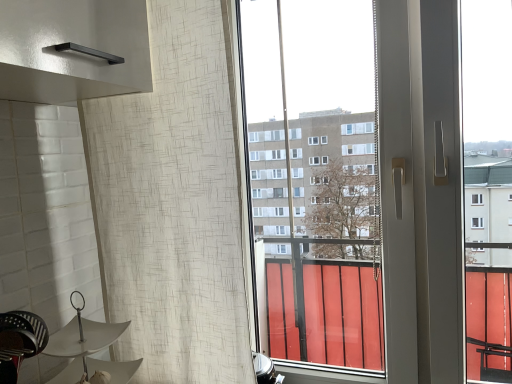
Where is `white textured curtain at left`? This screenshot has height=384, width=512. white textured curtain at left is located at coordinates (174, 203).

The width and height of the screenshot is (512, 384). Find the location of `white matte umbrella at lower left`. white matte umbrella at lower left is located at coordinates (88, 349).

What's the angular difference between white textured curtain at left and metallic black swivel chair at lower left's facing directions?

They differ by 85 degrees in their facing directions.

Is white textured curtain at left not close to metallic black swivel chair at lower left?

Actually, white textured curtain at left and metallic black swivel chair at lower left are a little close together.

Can you confirm if white textured curtain at left is positioned to the right of metallic black swivel chair at lower left?

Indeed, white textured curtain at left is positioned on the right side of metallic black swivel chair at lower left.

Considering the positions of objects white textured curtain at left and metallic black swivel chair at lower left in the image provided, who is behind, white textured curtain at left or metallic black swivel chair at lower left?

white textured curtain at left is further away from the camera.

Considering the points (84, 304) and (219, 237), which point is behind, point (84, 304) or point (219, 237)?

Point (84, 304)

Is white matte umbrella at lower left not close to white textured curtain at left?

They are positioned close to each other.

Can you confirm if white matte umbrella at lower left is shorter than white textured curtain at left?

Correct, white matte umbrella at lower left is not as tall as white textured curtain at left.

Is white matte umbrella at lower left positioned with its back to white textured curtain at left?

No, white matte umbrella at lower left's orientation is not away from white textured curtain at left.

Is point (16, 312) positioned behind point (77, 317)?

No, it is in front of (77, 317).

From the image's perspective, who appears lower, metallic black swivel chair at lower left or white matte umbrella at lower left?

white matte umbrella at lower left.

Consider the image. What's the angular difference between metallic black swivel chair at lower left and white matte umbrella at lower left's facing directions?

3.45 degrees separate the facing orientations of metallic black swivel chair at lower left and white matte umbrella at lower left.

How far apart are metallic black swivel chair at lower left and white matte umbrella at lower left?

The distance of metallic black swivel chair at lower left from white matte umbrella at lower left is 8.92 centimeters.

What's the angular difference between metallic black swivel chair at lower left and white textured curtain at left's facing directions?

metallic black swivel chair at lower left and white textured curtain at left are facing 85 degrees away from each other.

Is metallic black swivel chair at lower left wider or thinner than white textured curtain at left?

Clearly, metallic black swivel chair at lower left has more width compared to white textured curtain at left.

Based on the photo, is the depth of metallic black swivel chair at lower left greater than that of white textured curtain at left?

No, it is in front of white textured curtain at left.

Would you say metallic black swivel chair at lower left is a long distance from white textured curtain at left?

No.

Consider the image. Considering the relative sizes of white matte umbrella at lower left and metallic black swivel chair at lower left in the image provided, is white matte umbrella at lower left shorter than metallic black swivel chair at lower left?

No.

Is white matte umbrella at lower left inside or outside of metallic black swivel chair at lower left?

The correct answer is: outside.

Does white matte umbrella at lower left have a smaller size compared to metallic black swivel chair at lower left?

Actually, white matte umbrella at lower left might be larger than metallic black swivel chair at lower left.

From a real-world perspective, which object stands above the other?

metallic black swivel chair at lower left.

Is white textured curtain at left looking in the opposite direction of white matte umbrella at lower left?

That's right, white textured curtain at left is facing away from white matte umbrella at lower left.

Where is `lamp below the white textured curtain at left (from the image's perspective)`? lamp below the white textured curtain at left (from the image's perspective) is located at coordinates (88, 349).

Which is correct: white textured curtain at left is inside white matte umbrella at lower left, or outside of it?

white textured curtain at left is located beyond the bounds of white matte umbrella at lower left.

Does white textured curtain at left have a larger size compared to white matte umbrella at lower left?

Indeed, white textured curtain at left has a larger size compared to white matte umbrella at lower left.

Image resolution: width=512 pixels, height=384 pixels. Find the location of `shower curtain above the metallic black swivel chair at lower left (from the image's perspective)`. shower curtain above the metallic black swivel chair at lower left (from the image's perspective) is located at coordinates tap(174, 203).

Where is `lamp on the left of white textured curtain at left`? The image size is (512, 384). lamp on the left of white textured curtain at left is located at coordinates (88, 349).

Which object lies nearer to the anchor point metallic black swivel chair at lower left, white matte umbrella at lower left or white textured curtain at left?

white matte umbrella at lower left.

When comparing their distances from white textured curtain at left, does metallic black swivel chair at lower left or white matte umbrella at lower left seem further?

Among the two, metallic black swivel chair at lower left is located further to white textured curtain at left.

From the image, which object appears to be farther from white textured curtain at left, white matte umbrella at lower left or metallic black swivel chair at lower left?

Among the two, metallic black swivel chair at lower left is located further to white textured curtain at left.

Estimate the real-world distances between objects in this image. Which object is further from white matte umbrella at lower left, metallic black swivel chair at lower left or white textured curtain at left?

The object further to white matte umbrella at lower left is white textured curtain at left.

From the image, which object appears to be farther from metallic black swivel chair at lower left, white textured curtain at left or white matte umbrella at lower left?

white textured curtain at left.

When comparing their distances from white matte umbrella at lower left, does white textured curtain at left or metallic black swivel chair at lower left seem closer?

metallic black swivel chair at lower left lies closer to white matte umbrella at lower left than the other object.

Where is `swivel chair between white textured curtain at left and white matte umbrella at lower left in the vertical direction`? This screenshot has height=384, width=512. swivel chair between white textured curtain at left and white matte umbrella at lower left in the vertical direction is located at coordinates (19, 341).